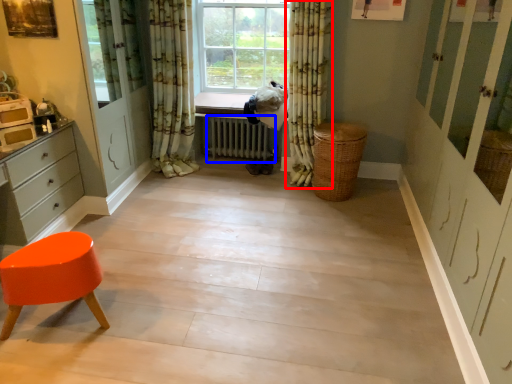
Question: Which object is further to the camera taking this photo, curtain (highlighted by a red box) or radiator (highlighted by a blue box)?

Choices:
 (A) curtain
 (B) radiator

Answer: (B)